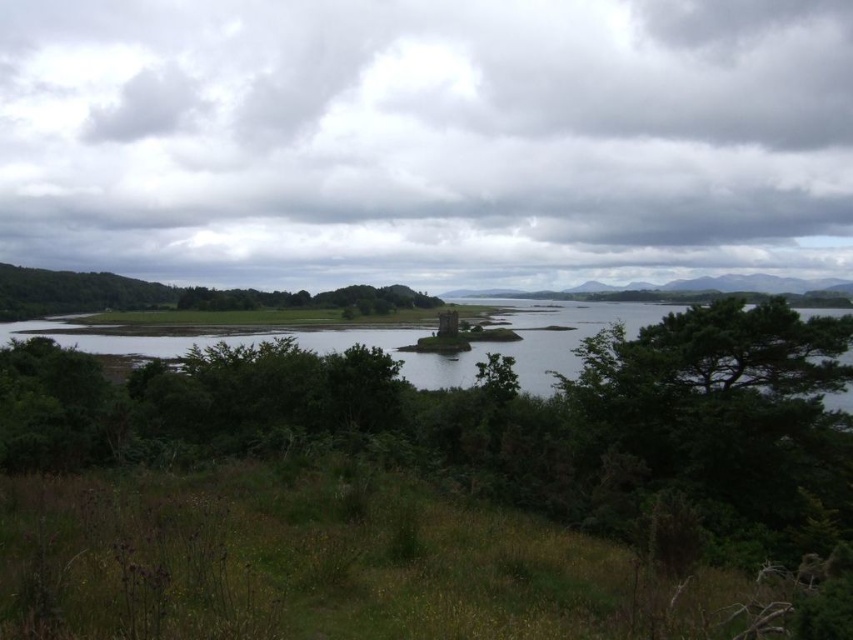
Is green grassy water at lower center positioned before green leafy tree at center?

Yes, green grassy water at lower center is closer to the viewer.

Is green grassy water at lower center above green leafy tree at center?

Incorrect, green grassy water at lower center is not positioned above green leafy tree at center.

Which is in front, point (519, 310) or point (207, 300)?

Point (207, 300) is in front.

Where is `green grassy water at lower center`? The width and height of the screenshot is (853, 640). green grassy water at lower center is located at coordinates coord(399,340).

Who is more distant from viewer, (236, 29) or (430, 371)?

The point (236, 29) is more distant.

Does point (817, 150) lie behind point (543, 337)?

Yes, point (817, 150) is behind point (543, 337).

The width and height of the screenshot is (853, 640). What do you see at coordinates (426, 140) in the screenshot?
I see `cloudy sky at upper center` at bounding box center [426, 140].

You are a GUI agent. You are given a task and a screenshot of the screen. Output one action in this format:
    pyautogui.click(x=<x>, y=<y>)
    Task: Click on the cloudy sky at upper center
    
    Given the screenshot: What is the action you would take?
    pos(426,140)

Based on the photo, is cloudy sky at upper center taller than green leafy tree at center?

Correct, cloudy sky at upper center is much taller as green leafy tree at center.

Is point (416, 118) behind point (323, 294)?

Yes.

Locate an element on the screen. This screenshot has width=853, height=640. cloudy sky at upper center is located at coordinates tap(426, 140).